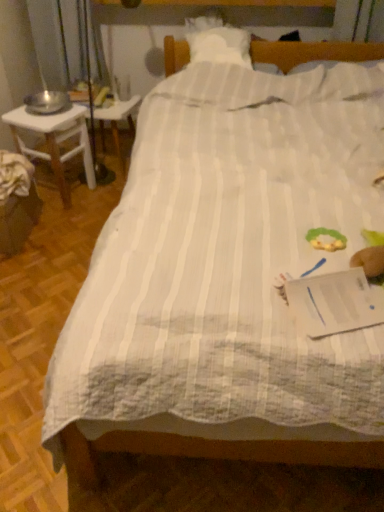
At what (x,y) coordinates should I click in order to perform the action: click on free point above white wooden desk at left (from a real-world perspective). Please return your answer as a coordinate pair (x, y). The width and height of the screenshot is (384, 512). Looking at the image, I should click on (42, 111).